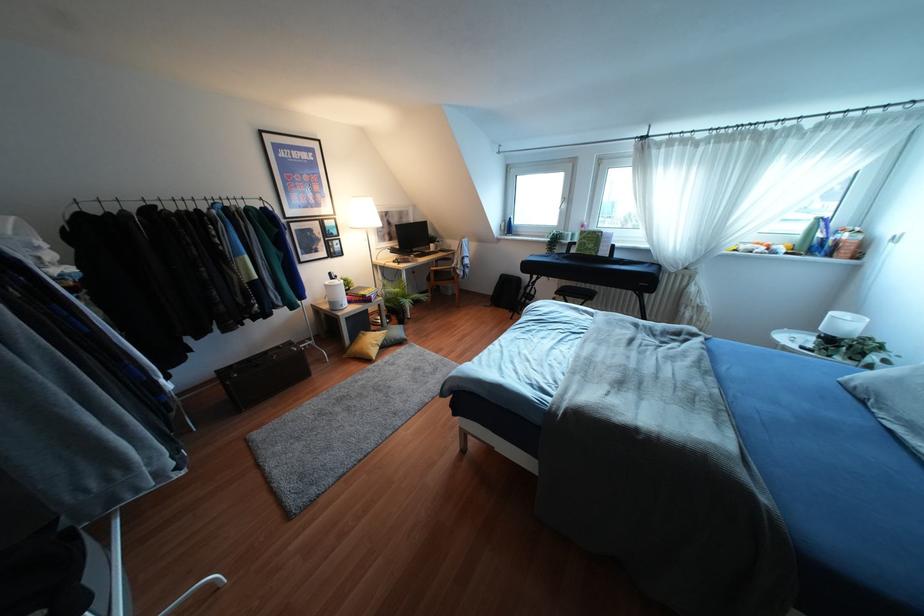
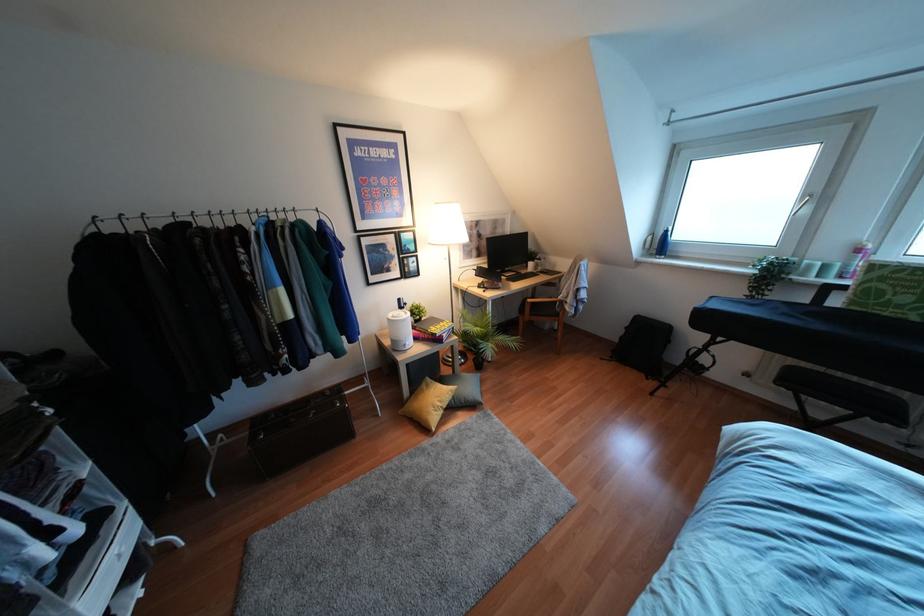
Locate, in the second image, the point that corresponds to pixel 507 227 in the first image.

(660, 245)